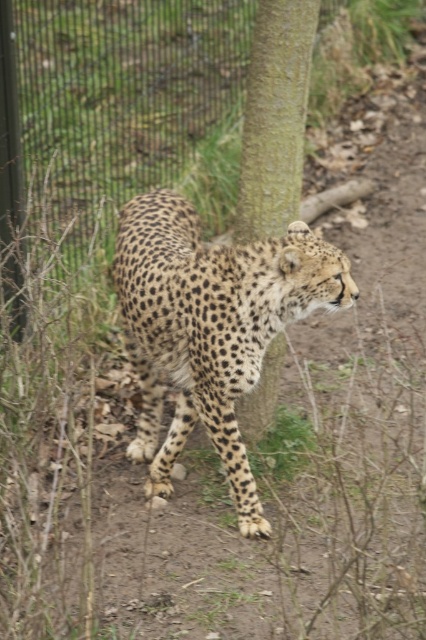
Does spotted fur cheetah at center have a smaller size compared to green textured bark at center?

No, spotted fur cheetah at center is not smaller than green textured bark at center.

Does point (146, 332) come behind point (264, 6)?

No, it is in front of (264, 6).

Who is more distant from viewer, (181, 426) or (276, 352)?

The point (276, 352) is behind.

I want to click on spotted fur cheetah at center, so click(x=210, y=326).